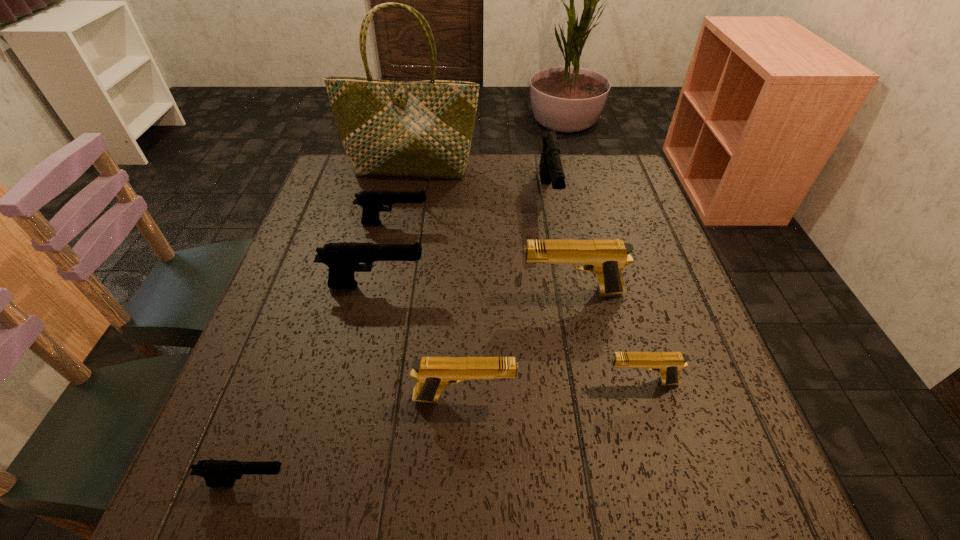
Locate an element on the screen. This screenshot has width=960, height=540. green shopping bag is located at coordinates (393, 128).

The image size is (960, 540). I want to click on shopping bag, so click(393, 128).

Locate an element on the screen. The width and height of the screenshot is (960, 540). the rightmost black pistol is located at coordinates (551, 171).

Where is `the farthest tan pistol`? the farthest tan pistol is located at coordinates (605, 258).

Locate an element on the screen. the third smallest black pistol is located at coordinates pyautogui.click(x=343, y=259).

This screenshot has width=960, height=540. Identify the location of the leftmost tan pistol. (433, 374).

Locate an element on the screen. the seventh farthest object is located at coordinates (433, 374).

The height and width of the screenshot is (540, 960). I want to click on the second smallest black pistol, so click(372, 202).

Locate an element on the screen. the smallest tan pistol is located at coordinates (669, 364).

I want to click on the second farthest tan pistol, so click(669, 364).